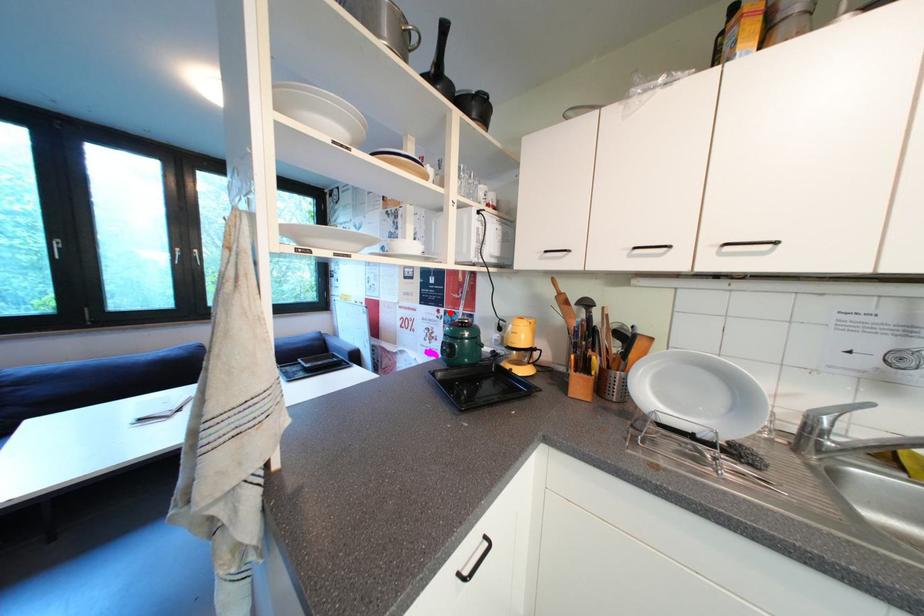
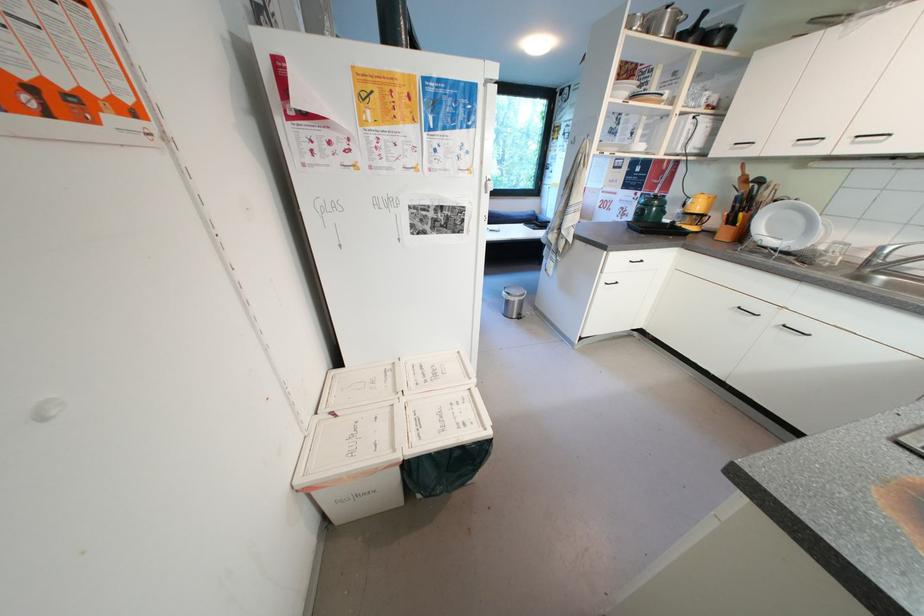
Question: I am providing you with two images of the same scene from different viewpoints. Image1 has a red point marked. In image2, the corresponding 3D location appears at what relative position? Reply with the corresponding letter.

Choices:
 (A) Closer
 (B) Farther

Answer: (A)